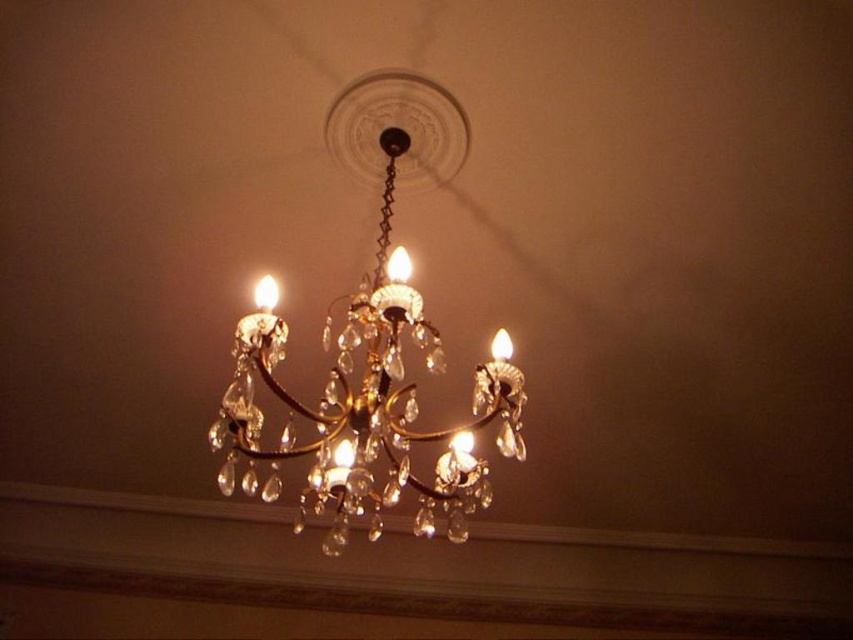
Is gold metallic chandelier at center further to camera compared to matte gold chandelier at center?

No, gold metallic chandelier at center is in front of matte gold chandelier at center.

From the picture: Between gold metallic chandelier at center and matte gold chandelier at center, which one appears on the right side from the viewer's perspective?

From the viewer's perspective, gold metallic chandelier at center appears more on the right side.

What do you see at coordinates (375, 349) in the screenshot? The height and width of the screenshot is (640, 853). I see `gold metallic chandelier at center` at bounding box center [375, 349].

I want to click on gold metallic chandelier at center, so click(x=375, y=349).